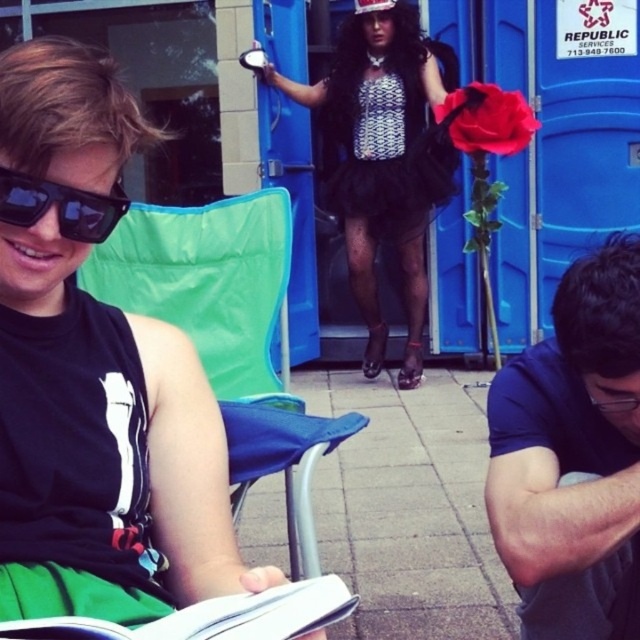
Which is in front, point (72, 92) or point (452, 67)?

Positioned in front is point (72, 92).

Is black matte sunglasses at upper left to the left of black tulle skirt at center from the viewer's perspective?

Yes, black matte sunglasses at upper left is to the left of black tulle skirt at center.

Find the location of a particular element. Image resolution: width=640 pixels, height=640 pixels. black matte sunglasses at upper left is located at coordinates (93, 374).

Identify the location of black matte sunglasses at upper left. (93, 374).

Who is shorter, black tulle skirt at center or white paper book at lower left?

white paper book at lower left

Does black tulle skirt at center have a greater width compared to white paper book at lower left?

Yes, black tulle skirt at center is wider than white paper book at lower left.

Who is more forward, (369, 152) or (275, 602)?

Point (275, 602) is more forward.

This screenshot has height=640, width=640. Find the location of `black tulle skirt at center`. black tulle skirt at center is located at coordinates (385, 157).

Does point (16, 490) come farther from viewer compared to point (296, 596)?

That is True.

Can you confirm if black matte sunglasses at upper left is bigger than white paper book at lower left?

Yes, black matte sunglasses at upper left is bigger than white paper book at lower left.

Which is behind, point (26, 172) or point (224, 624)?

Positioned behind is point (26, 172).

Image resolution: width=640 pixels, height=640 pixels. Identify the location of black matte sunglasses at upper left. (93, 374).